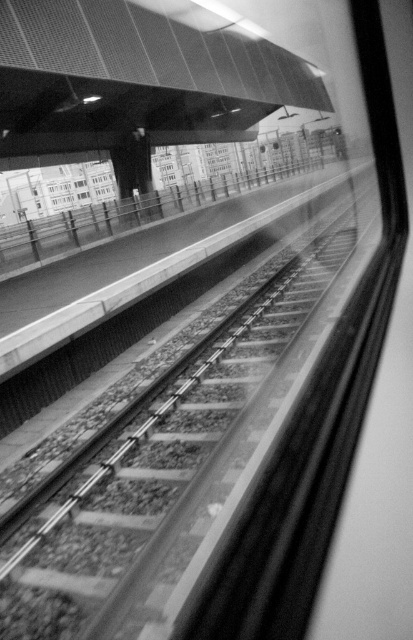
Question: Which point is farther to the camera?

Choices:
 (A) transparent glass window at upper center
 (B) transparent glass window at center

Answer: (B)

Question: Is transparent glass window at center positioned before transparent glass window at upper center?

Choices:
 (A) yes
 (B) no

Answer: (B)

Question: Is transparent glass window at center to the right of transparent glass window at upper center from the viewer's perspective?

Choices:
 (A) no
 (B) yes

Answer: (B)

Question: Does transparent glass window at center have a lesser width compared to transparent glass window at upper center?

Choices:
 (A) yes
 (B) no

Answer: (B)

Question: Which point is farther from the camera taking this photo?

Choices:
 (A) (78, 186)
 (B) (83, 193)

Answer: (B)